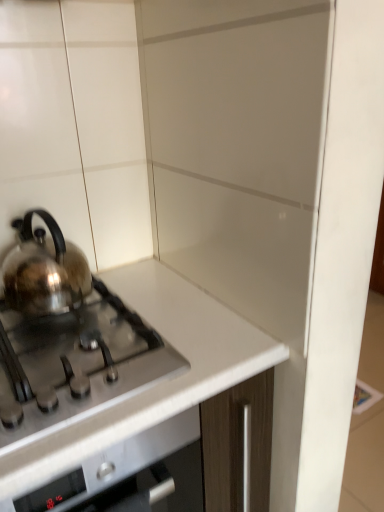
Question: Is satin silver gas stove at left bigger or smaller than satin silver kettle at left?

Choices:
 (A) big
 (B) small

Answer: (A)

Question: Is point (132, 352) closer or farther from the camera than point (33, 292)?

Choices:
 (A) farther
 (B) closer

Answer: (B)

Question: Which object is the farthest from the satin silver kettle at left?

Choices:
 (A) white glossy countertop at center
 (B) satin silver gas stove at left

Answer: (A)

Question: Considering the real-world distances, which object is farthest from the satin silver gas stove at left?

Choices:
 (A) white glossy countertop at center
 (B) satin silver kettle at left

Answer: (B)